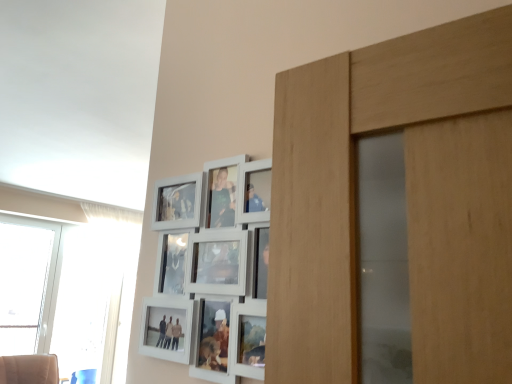
Question: Considering the relative sizes of transparent glass window at left, which is counted as the second window, starting from the left, and transparent glass window at left, acting as the 2th window starting from the right, in the image provided, is transparent glass window at left, which is counted as the second window, starting from the left, bigger than transparent glass window at left, acting as the 2th window starting from the right,?

Choices:
 (A) yes
 (B) no

Answer: (B)

Question: Can you see transparent glass window at left, which is counted as the second window, starting from the left, touching transparent glass window at left, the first window from the left?

Choices:
 (A) no
 (B) yes

Answer: (A)

Question: Would you say transparent glass window at left, which is counted as the second window, starting from the left, is outside transparent glass window at left, the first window from the left?

Choices:
 (A) no
 (B) yes

Answer: (B)

Question: Considering the relative sizes of transparent glass window at left, the 1th window when ordered from right to left, and transparent glass window at left, acting as the 2th window starting from the right, in the image provided, is transparent glass window at left, the 1th window when ordered from right to left, smaller than transparent glass window at left, acting as the 2th window starting from the right,?

Choices:
 (A) no
 (B) yes

Answer: (B)

Question: Is transparent glass window at left, the 1th window when ordered from right to left, not near transparent glass window at left, the first window from the left?

Choices:
 (A) yes
 (B) no

Answer: (B)

Question: From a real-world perspective, is transparent glass window at left, which is counted as the second window, starting from the left, located beneath transparent glass window at left, the first window from the left?

Choices:
 (A) yes
 (B) no

Answer: (A)

Question: From the image's perspective, is transparent glass window at left, the first window from the left, located beneath transparent glass window at left, which is counted as the second window, starting from the left?

Choices:
 (A) yes
 (B) no

Answer: (B)

Question: Is transparent glass window at left, acting as the 2th window starting from the right, positioned behind transparent glass window at left, the 1th window when ordered from right to left?

Choices:
 (A) yes
 (B) no

Answer: (B)

Question: Could you tell me if transparent glass window at left, the first window from the left, is turned towards transparent glass window at left, the 1th window when ordered from right to left?

Choices:
 (A) no
 (B) yes

Answer: (A)

Question: From a real-world perspective, is transparent glass window at left, the first window from the left, below transparent glass window at left, which is counted as the second window, starting from the left?

Choices:
 (A) no
 (B) yes

Answer: (A)

Question: Considering the relative sizes of transparent glass window at left, the first window from the left, and transparent glass window at left, the 1th window when ordered from right to left, in the image provided, is transparent glass window at left, the first window from the left, bigger than transparent glass window at left, the 1th window when ordered from right to left,?

Choices:
 (A) no
 (B) yes

Answer: (B)

Question: Is transparent glass window at left, acting as the 2th window starting from the right, to the right of transparent glass window at left, the 1th window when ordered from right to left, from the viewer's perspective?

Choices:
 (A) yes
 (B) no

Answer: (B)

Question: From a real-world perspective, is transparent glass window at left, the first window from the left, positioned above or below transparent glass window at left, the 1th window when ordered from right to left?

Choices:
 (A) above
 (B) below

Answer: (A)